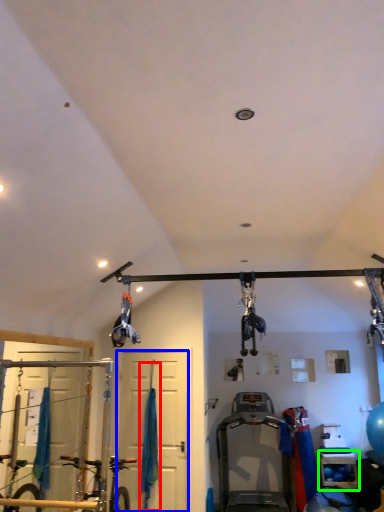
Question: Estimate the real-world distances between objects in this image. Which object is closer to curtain (highlighted by a red box), door (highlighted by a blue box) or shelf (highlighted by a green box)?

Choices:
 (A) door
 (B) shelf

Answer: (A)